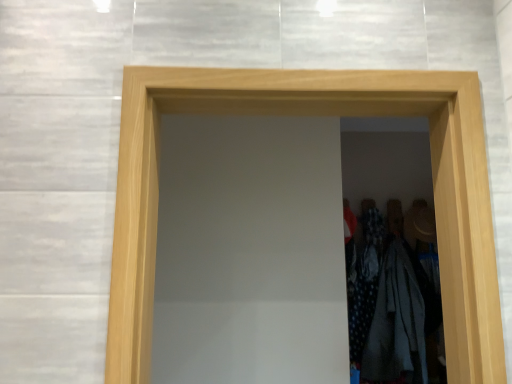
Question: From a real-world perspective, is polka dot fabric dress at right positioned above or below natural wood door at center?

Choices:
 (A) below
 (B) above

Answer: (A)

Question: From the image's perspective, relative to natural wood door at center, is polka dot fabric dress at right above or below?

Choices:
 (A) above
 (B) below

Answer: (B)

Question: Estimate the real-world distances between objects in this image. Which object is farther from the natural wood door at center?

Choices:
 (A) polka dot fabric dress at right
 (B) white cotton shirt at right

Answer: (A)

Question: Estimate the real-world distances between objects in this image. Which object is farther from the polka dot fabric dress at right?

Choices:
 (A) white cotton shirt at right
 (B) natural wood door at center

Answer: (B)